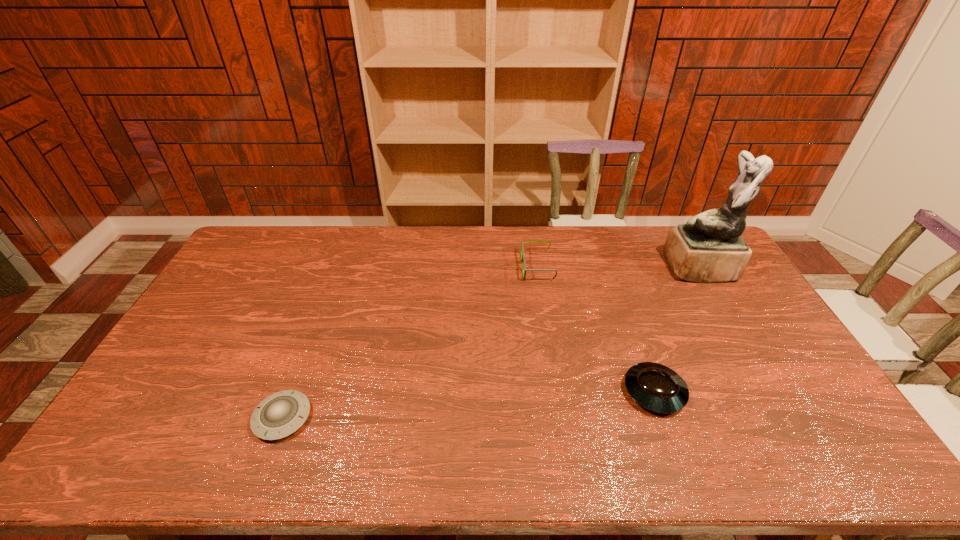
Find the location of a particular element. free space between the shorter saucer and the second object from right to left is located at coordinates (468, 404).

Locate an element on the screen. This screenshot has height=540, width=960. free space between the leftmost object and the third object from right to left is located at coordinates (410, 342).

At what (x,y) coordinates should I click in order to perform the action: click on free space between the third object from right to left and the sculpture. Please return your answer as a coordinate pair (x, y). Looking at the image, I should click on (618, 268).

Locate an element on the screen. free space that is in between the spectacles and the sculpture is located at coordinates (618, 268).

Identify the location of object that stands as the third closest to the rightmost object. The height and width of the screenshot is (540, 960). (279, 415).

Image resolution: width=960 pixels, height=540 pixels. In order to click on object that is the third closest to the third object from left to right in this screenshot , I will do `click(279, 415)`.

Where is `vacant area in the image that satisfies the following two spatial constraints: 1. on the lens of the spectacles; 2. on the right side of the third object from left to right`? The width and height of the screenshot is (960, 540). vacant area in the image that satisfies the following two spatial constraints: 1. on the lens of the spectacles; 2. on the right side of the third object from left to right is located at coordinates (557, 392).

You are a GUI agent. You are given a task and a screenshot of the screen. Output one action in this format:
    pyautogui.click(x=<x>, y=<y>)
    Task: Click on the free spot that satisfies the following two spatial constraints: 1. on the back side of the right saucer; 2. on the right side of the shorter saucer
    
    Given the screenshot: What is the action you would take?
    pyautogui.click(x=292, y=392)

The width and height of the screenshot is (960, 540). What are the coordinates of `free spot that satisfies the following two spatial constraints: 1. on the lens of the spectacles; 2. on the right side of the right saucer` in the screenshot? It's located at (557, 392).

What are the coordinates of `free space that satisfies the following two spatial constraints: 1. on the lens of the second object from left to right; 2. on the back side of the second object from right to left` in the screenshot? It's located at (557, 392).